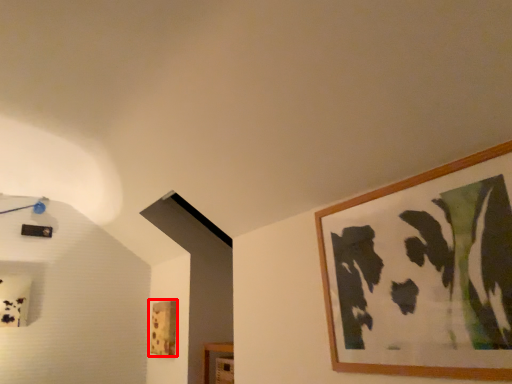
Question: From the image's perspective, considering the relative positions of picture frame (annotated by the red box) and picture frame in the image provided, where is picture frame (annotated by the red box) located with respect to the staircase?

Choices:
 (A) below
 (B) above

Answer: (A)